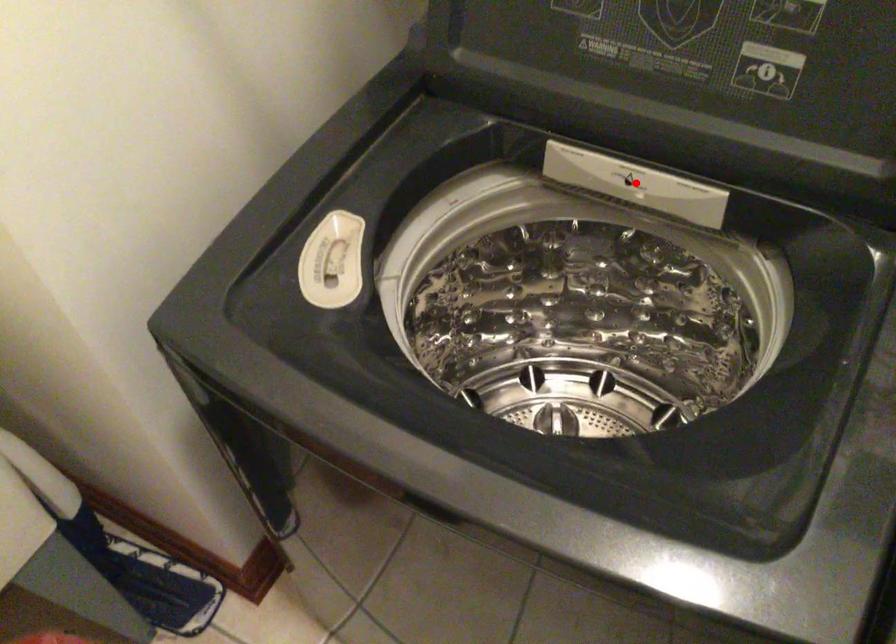
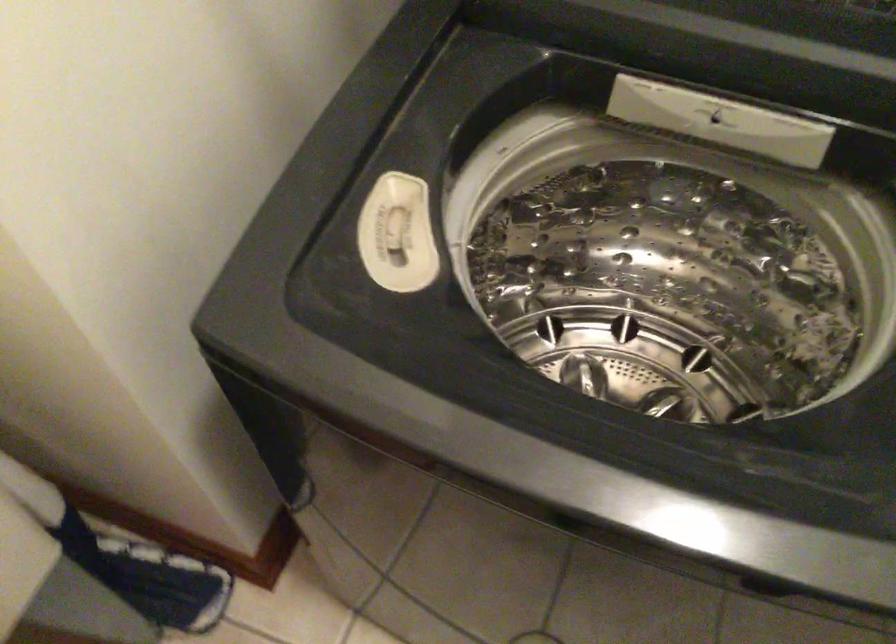
Locate, in the second image, the point that corresponds to the highlighted location in the first image.

(719, 120)